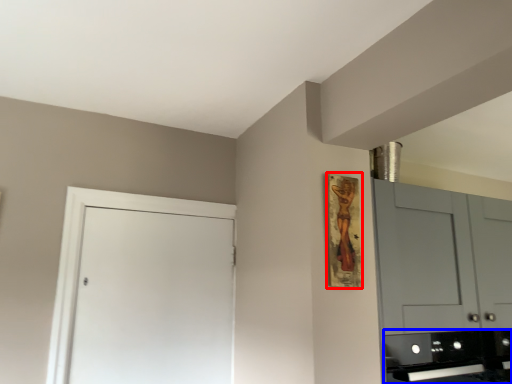
Question: Which object is further to the camera taking this photo, picture frame (highlighted by a red box) or appliance (highlighted by a blue box)?

Choices:
 (A) picture frame
 (B) appliance

Answer: (B)